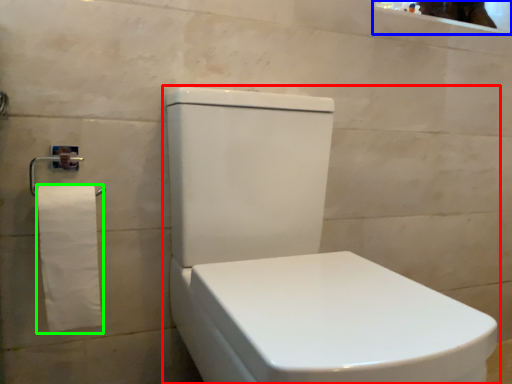
Question: Considering the real-world distances, which object is closest to toilet (highlighted by a red box)? mirror (highlighted by a blue box) or toilet paper (highlighted by a green box).

Choices:
 (A) mirror
 (B) toilet paper

Answer: (B)